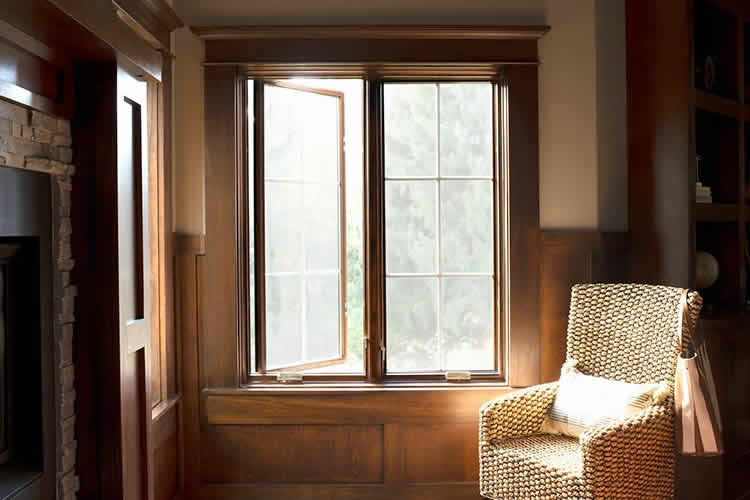
Image resolution: width=750 pixels, height=500 pixels. I want to click on wall, so click(586, 148).